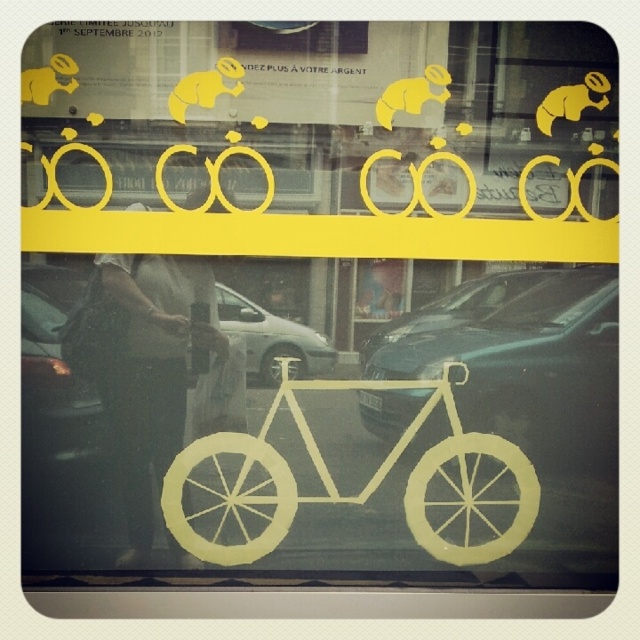
You are a delivery person who needs to load a metallic silver bicycle at center and a yellow matte animal at upper right into a truck. The truck has a loading height limit of 1.2 meters. Can both items be loaded without exceeding the height limit?

The metallic silver bicycle at center is larger in size than the yellow matte animal at upper right. However, since the exact height of each item isn not provided in the description, it is impossible to determine if they will exceed the 1.2 meter loading height limit. Additional measurements are required.

You are a delivery person trying to park your motorcycle between the silver metallic car at center and the yellow matte animal at upper center. Can your motorcycle fit between them if it requires 1 meter of space?

The silver metallic car at center is wider than the yellow matte animal at upper center. However, since the exact widths are not provided, it is impossible to determine if the motorcycle can fit between them with 1 meter of space required.

You are a pedestrian standing on the sidewalk outside the storefront. You see the silver metallic car at center and the yellow matte animal at upper right in the window display. Which object is closer to you?

The silver metallic car at center is closer to you because the yellow matte animal at upper right is behind it.